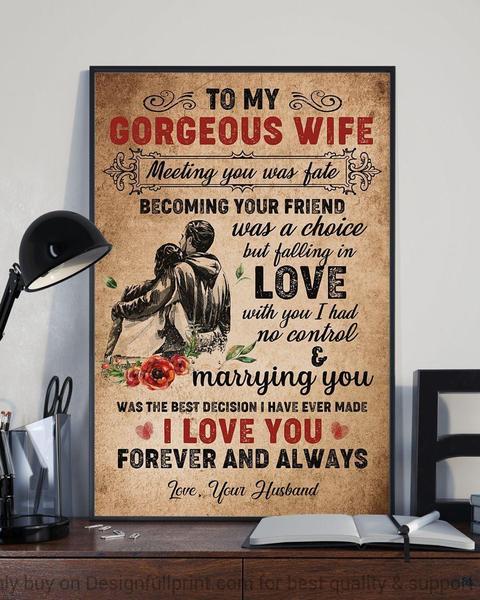
Locate an element on the screen. The height and width of the screenshot is (600, 480). walls is located at coordinates (433, 208), (28, 365).